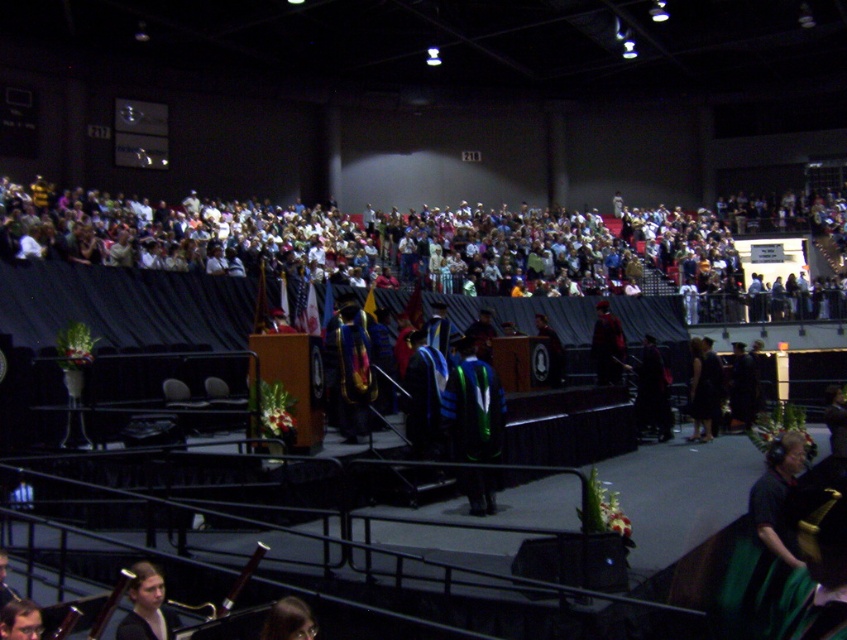
Does multicolored fabric crowd at upper center have a greater height compared to smooth brown hair at lower left?

Indeed, multicolored fabric crowd at upper center has a greater height compared to smooth brown hair at lower left.

Measure the distance between point (349, 276) and camera.

Point (349, 276) and camera are 73.46 feet apart from each other.

This screenshot has width=847, height=640. I want to click on multicolored fabric crowd at upper center, so click(418, 250).